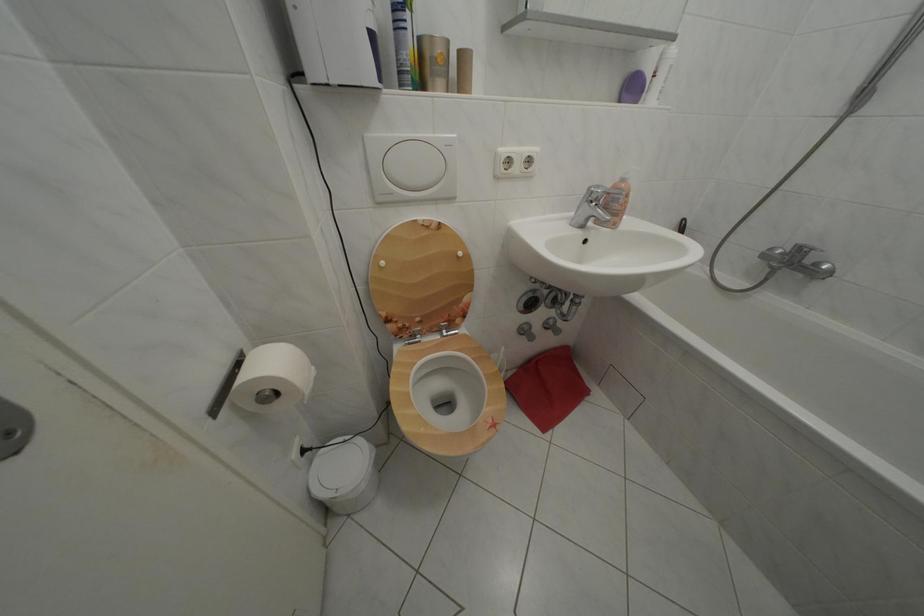
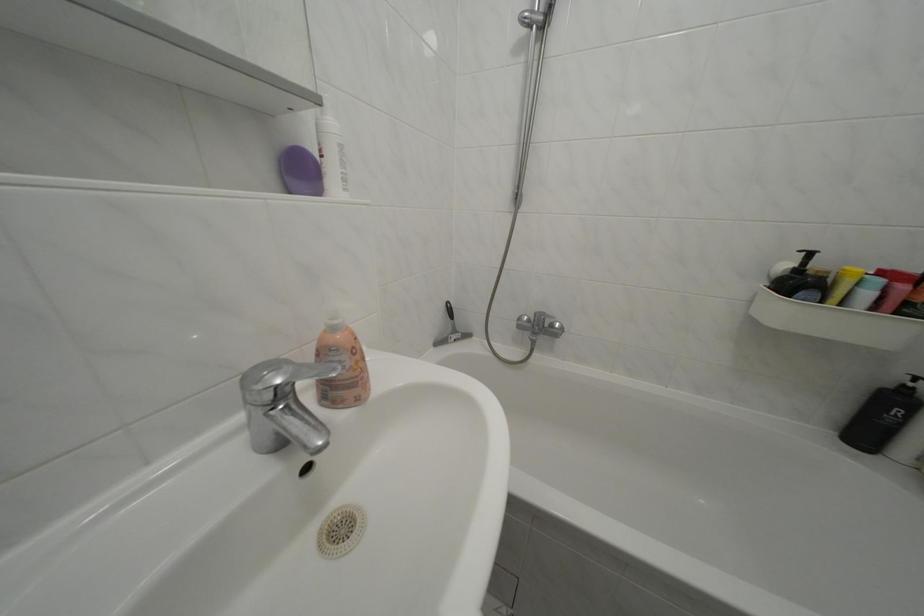
In the second image, find the point that corresponds to pixel 600 193 in the first image.

(252, 384)